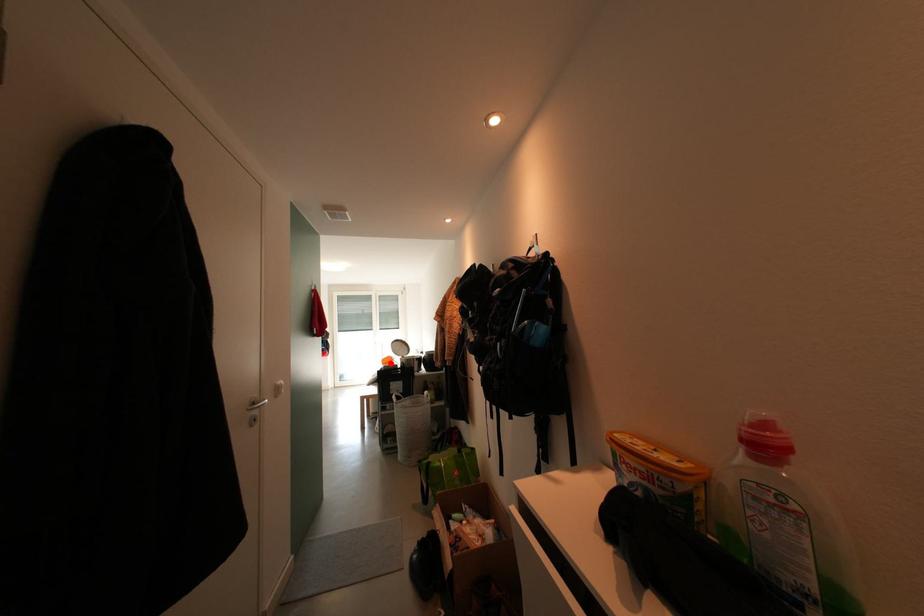
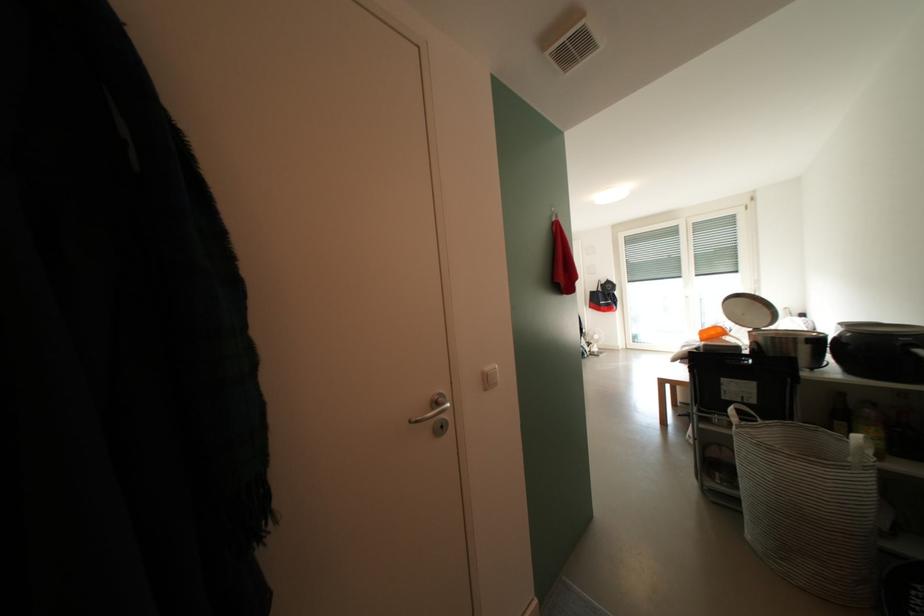
Question: I am providing you with two images of the same scene from different viewpoints. In image1, a red point is highlighted. Considering the same 3D point in image2, which of the following is correct?

Choices:
 (A) It is closer
 (B) It is farther

Answer: (A)